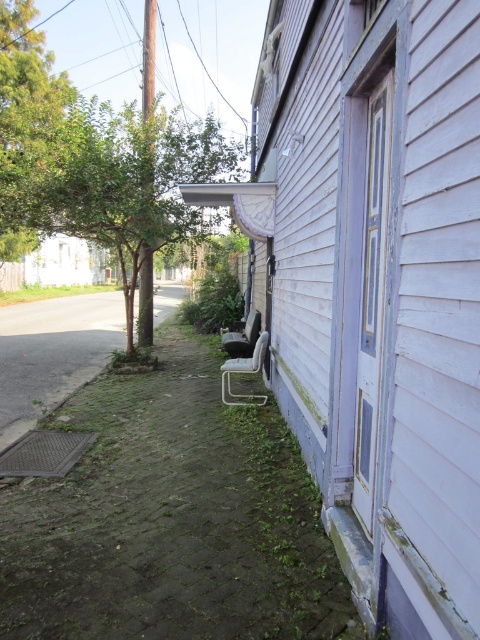
In the scene shown: You are standing on the cobblestone sidewalk in front of the weathered house with light purple siding. There is a metal framed chair here. You want to move the chair to the base of the green leafy tree at upper left. Based on the coordinates provided, is the tree positioned to the north or south of the house?

The green leafy tree at upper left is located at point (x=25, y=125), which places it to the north of the house since it is positioned at the upper part of the image frame.

You are a delivery person trying to reach the house with the light purple siding. You see the green leafy tree at upper left and the metallic silver chair at lower center. Which object is closer to the house?

The metallic silver chair at lower center is behind the green leafy tree at upper left, so the green leafy tree at upper left is closer to the house.